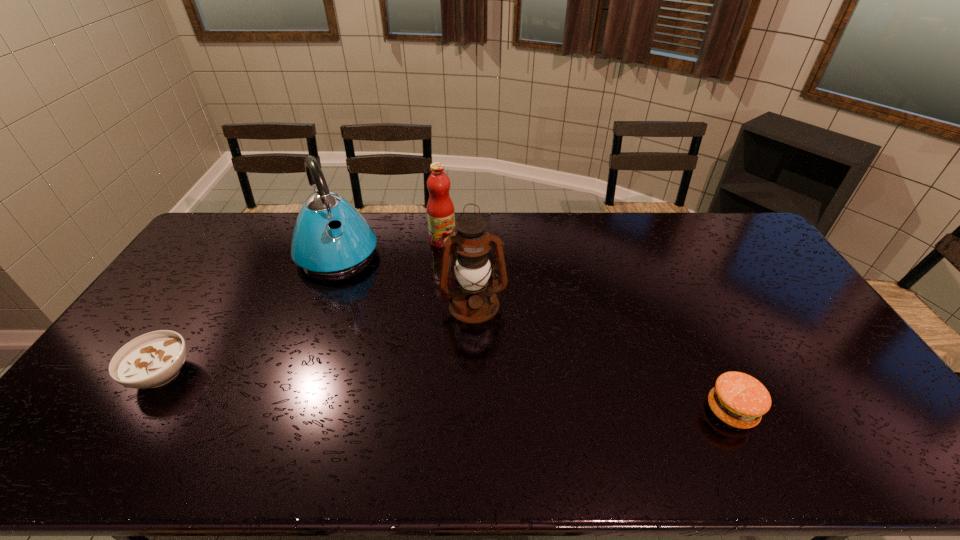
This screenshot has height=540, width=960. Find the location of `free space on the desktop that is between the leftmost object and the rightmost object and is positioned on the front label of the fruit juice`. free space on the desktop that is between the leftmost object and the rightmost object and is positioned on the front label of the fruit juice is located at coordinates (522, 397).

What are the coordinates of `free spot on the desktop that is between the leftmost object and the second shortest object and is positioned at the spout of the kettle` in the screenshot? It's located at (406, 389).

The height and width of the screenshot is (540, 960). What are the coordinates of `vacant space on the desktop that is between the leftmost object and the fourth tallest object and is positioned on the side of the lantern, there is a wick adjustment knob` in the screenshot? It's located at (483, 394).